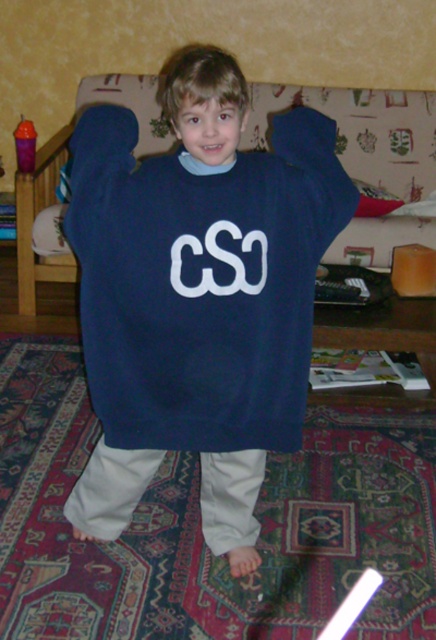
Does navy blue sweater at center come in front of white matte cso at center?

Yes.

Is point (113, 252) less distant than point (170, 276)?

No.

You are a GUI agent. You are given a task and a screenshot of the screen. Output one action in this format:
    pyautogui.click(x=<x>, y=<y>)
    Task: Click on the navy blue sweater at center
    
    Given the screenshot: What is the action you would take?
    pyautogui.click(x=197, y=296)